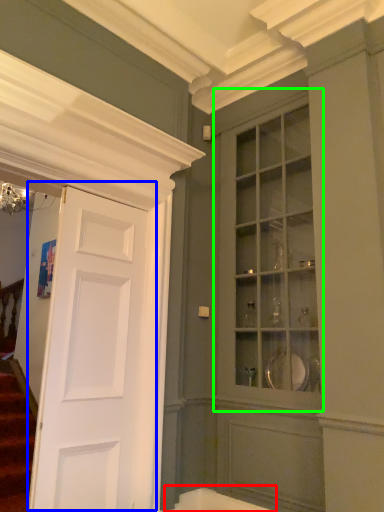
Question: Considering the real-world distances, which object is farthest from bath (highlighted by a red box)? door (highlighted by a blue box) or cabinetry (highlighted by a green box)?

Choices:
 (A) door
 (B) cabinetry

Answer: (B)